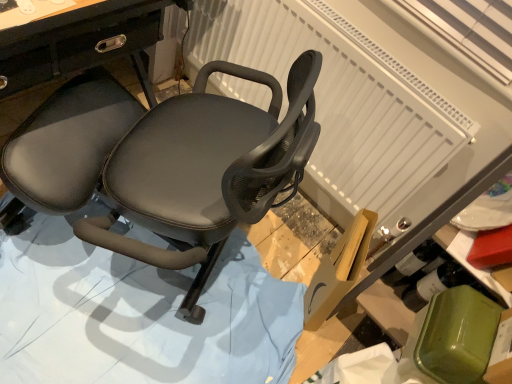
Question: Is matte black chair at center at the right side of black leather chair at center?

Choices:
 (A) yes
 (B) no

Answer: (A)

Question: From a real-world perspective, is matte black chair at center on top of black leather chair at center?

Choices:
 (A) yes
 (B) no

Answer: (A)

Question: Is black leather chair at center completely or partially inside matte black chair at center?

Choices:
 (A) no
 (B) yes

Answer: (B)

Question: Can you confirm if matte black chair at center is thinner than black leather chair at center?

Choices:
 (A) no
 (B) yes

Answer: (B)

Question: From the image's perspective, is matte black chair at center located above black leather chair at center?

Choices:
 (A) no
 (B) yes

Answer: (B)

Question: Is matte black chair at center taller or shorter than black leather chair at center?

Choices:
 (A) short
 (B) tall

Answer: (B)

Question: Is matte black chair at center wider or thinner than black leather chair at center?

Choices:
 (A) wide
 (B) thin

Answer: (B)

Question: Is point (204, 175) positioned closer to the camera than point (180, 329)?

Choices:
 (A) farther
 (B) closer

Answer: (B)

Question: Is matte black chair at center inside or outside of black leather chair at center?

Choices:
 (A) outside
 (B) inside

Answer: (A)

Question: In terms of height, does white textured radiator at upper center look taller or shorter compared to black leather chair at center?

Choices:
 (A) short
 (B) tall

Answer: (B)

Question: Looking at the image, does white textured radiator at upper center seem bigger or smaller compared to black leather chair at center?

Choices:
 (A) small
 (B) big

Answer: (A)

Question: Is point (362, 183) positioned closer to the camera than point (12, 279)?

Choices:
 (A) farther
 (B) closer

Answer: (A)

Question: Relative to black leather chair at center, is white textured radiator at upper center in front or behind?

Choices:
 (A) front
 (B) behind

Answer: (B)

Question: Looking at the image, does matte black chair at center seem bigger or smaller compared to white textured radiator at upper center?

Choices:
 (A) big
 (B) small

Answer: (A)

Question: In terms of width, does matte black chair at center look wider or thinner when compared to white textured radiator at upper center?

Choices:
 (A) thin
 (B) wide

Answer: (B)